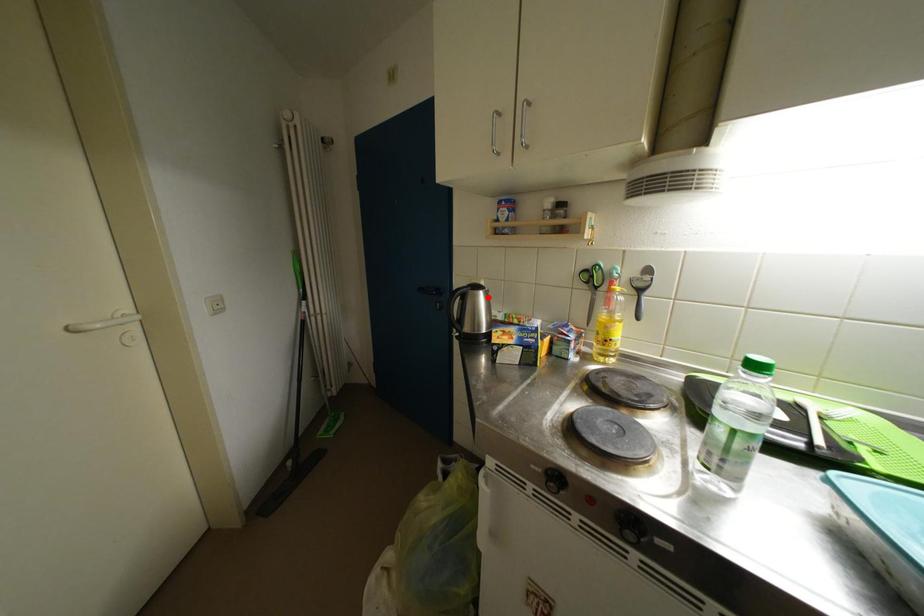
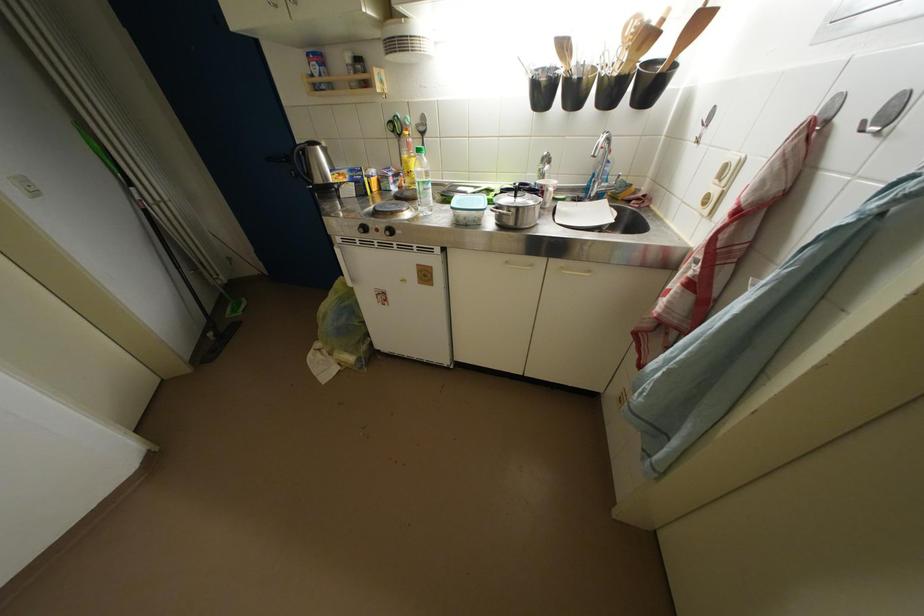
Where in the second image is the point corresponding to the highlighted location from the first image?

(324, 152)